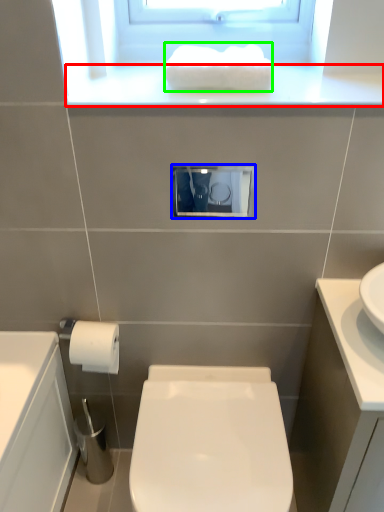
Question: Estimate the real-world distances between objects in this image. Which object is farther from window sill (highlighted by a red box), medicine cabinet (highlighted by a blue box) or hand towel (highlighted by a green box)?

Choices:
 (A) medicine cabinet
 (B) hand towel

Answer: (A)